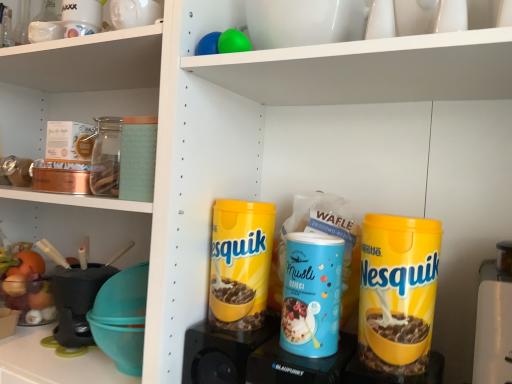
Question: Can you confirm if yellow plastic speaker at lower center, the first appliance positioned from the left, is positioned to the left of blue matte musli at center?

Choices:
 (A) yes
 (B) no

Answer: (A)

Question: Is yellow plastic speaker at lower center, the first appliance positioned from the left, located outside blue matte musli at center?

Choices:
 (A) no
 (B) yes

Answer: (B)

Question: Can you confirm if yellow plastic speaker at lower center, the first appliance positioned from the left, is taller than blue matte musli at center?

Choices:
 (A) no
 (B) yes

Answer: (A)

Question: Can blue matte musli at center be found inside yellow plastic speaker at lower center, the 2th appliance from the right?

Choices:
 (A) yes
 (B) no

Answer: (B)

Question: Considering the relative positions of yellow plastic speaker at lower center, the first appliance positioned from the left, and blue matte musli at center in the image provided, is yellow plastic speaker at lower center, the first appliance positioned from the left, in front of blue matte musli at center?

Choices:
 (A) no
 (B) yes

Answer: (A)

Question: From the image's perspective, relative to blue matte musli at center, is yellow matte nesquik canister at center, which ranks as the 1th cereal in back-to-front order, above or below?

Choices:
 (A) above
 (B) below

Answer: (A)

Question: In the image, is yellow matte nesquik canister at center, the second cereal from the right, on the left side or the right side of blue matte musli at center?

Choices:
 (A) left
 (B) right

Answer: (A)

Question: Is yellow matte nesquik canister at center, the second cereal from the right, taller or shorter than blue matte musli at center?

Choices:
 (A) tall
 (B) short

Answer: (A)

Question: From a real-world perspective, relative to blue matte musli at center, is yellow matte nesquik canister at center, the second cereal from the right, vertically above or below?

Choices:
 (A) above
 (B) below

Answer: (A)

Question: In terms of width, does blue matte musli at center look wider or thinner when compared to yellow matte nesquik canister at center right, the first cereal viewed from the front?

Choices:
 (A) wide
 (B) thin

Answer: (B)

Question: Is blue matte musli at center inside the boundaries of yellow matte nesquik canister at center right, the first cereal viewed from the front, or outside?

Choices:
 (A) outside
 (B) inside

Answer: (A)

Question: Considering their positions, is blue matte musli at center located in front of or behind yellow matte nesquik canister at center right, which ranks as the 2th cereal in back-to-front order?

Choices:
 (A) behind
 (B) front

Answer: (A)

Question: From the image's perspective, is blue matte musli at center positioned above or below yellow matte nesquik canister at center right, marked as the 1th cereal in a right-to-left arrangement?

Choices:
 (A) below
 (B) above

Answer: (A)

Question: From the image's perspective, is yellow matte nesquik canister at center, the second cereal from the right, positioned above or below yellow matte nesquik canister at center right, the first cereal viewed from the front?

Choices:
 (A) below
 (B) above

Answer: (B)

Question: In the image, is yellow matte nesquik canister at center, marked as the 2th cereal in a front-to-back arrangement, positioned in front of or behind yellow matte nesquik canister at center right, which ranks as the 2th cereal in back-to-front order?

Choices:
 (A) behind
 (B) front

Answer: (A)